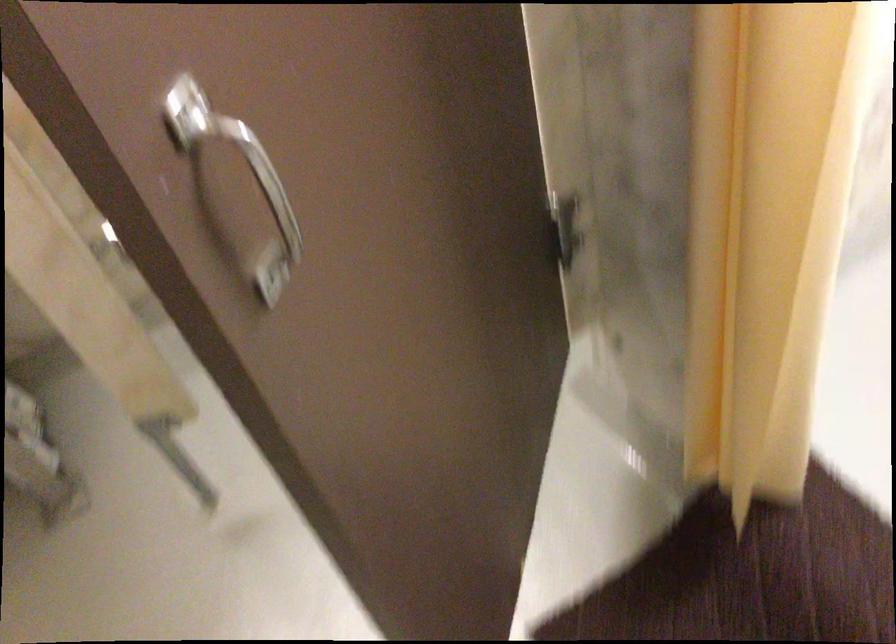
Where is `silver cabinet handle`? This screenshot has height=644, width=896. silver cabinet handle is located at coordinates (237, 176).